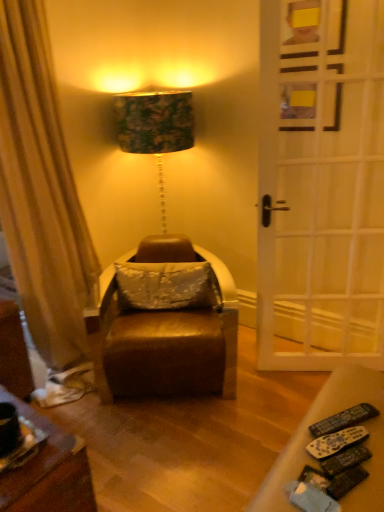
Describe the element at coordinates (321, 183) in the screenshot. The image size is (384, 512). I see `white wooden door at right` at that location.

Describe the element at coordinates (167, 286) in the screenshot. I see `satin white pillow at center` at that location.

Locate an element on the screen. leather swivel chair at center is located at coordinates point(168,335).

Considering their positions, is satin white pillow at center located in front of or behind black plastic remote control at lower right, arranged as the first remote control when viewed from the front?

Visually, satin white pillow at center is located behind black plastic remote control at lower right, arranged as the first remote control when viewed from the front.

What's the angular difference between satin white pillow at center and black plastic remote control at lower right, which is the 2th remote control from back to front,'s facing directions?

satin white pillow at center and black plastic remote control at lower right, which is the 2th remote control from back to front, are facing 70.6 degrees away from each other.

This screenshot has height=512, width=384. I want to click on pillow above the black plastic remote control at lower right, arranged as the first remote control when viewed from the front (from the image's perspective), so click(x=167, y=286).

Which is behind, point (156, 270) or point (314, 453)?

The point (156, 270) is behind.

Is leather swivel chair at center not near black plastic remote control at lower right, arranged as the first remote control when viewed from the front?

Absolutely, leather swivel chair at center is distant from black plastic remote control at lower right, arranged as the first remote control when viewed from the front.

Which of these two, leather swivel chair at center or black plastic remote control at lower right, which is the 2th remote control from back to front, stands taller?

leather swivel chair at center.

From a real-world perspective, count 2nd remote controls upward from the leather swivel chair at center and point to it. Please provide its 2D coordinates.

[(336, 442)]

Choose the correct answer: Is white wooden door at right inside leather swivel chair at center or outside it?

white wooden door at right is outside leather swivel chair at center.

At what (x,y) coordinates should I click in order to perform the action: click on swivel chair to the left of white wooden door at right. Please return your answer as a coordinate pair (x, y). Image resolution: width=384 pixels, height=512 pixels. Looking at the image, I should click on (168, 335).

Which is more to the left, white wooden door at right or leather swivel chair at center?

Positioned to the left is leather swivel chair at center.

From the image's perspective, is white wooden door at right over leather swivel chair at center?

Yes, from the image's perspective, white wooden door at right is above leather swivel chair at center.

Considering the points (189, 283) and (314, 178), which point is behind, point (189, 283) or point (314, 178)?

Positioned behind is point (314, 178).

From a real-world perspective, which object stands above the other?

white wooden door at right is physically above.

Locate an element on the screen. The width and height of the screenshot is (384, 512). pillow below the white wooden door at right (from the image's perspective) is located at coordinates (167, 286).

From the image's perspective, which object appears higher, satin white pillow at center or white wooden door at right?

white wooden door at right is shown above in the image.

From the picture: From a real-world perspective, who is located higher, black plastic remote control at lower right, the 1th remote control when ordered from back to front, or white wooden door at right?

white wooden door at right, from a real-world perspective.

Considering the relative sizes of black plastic remote control at lower right, the 1th remote control when ordered from back to front, and white wooden door at right in the image provided, is black plastic remote control at lower right, the 1th remote control when ordered from back to front, thinner than white wooden door at right?

In fact, black plastic remote control at lower right, the 1th remote control when ordered from back to front, might be wider than white wooden door at right.

You are a GUI agent. You are given a task and a screenshot of the screen. Output one action in this format:
    pyautogui.click(x=<x>, y=<y>)
    Task: Click on the remote control that is the 1st object located in front of the white wooden door at right
    The width and height of the screenshot is (384, 512).
    Given the screenshot: What is the action you would take?
    pyautogui.click(x=344, y=420)

Can you confirm if black plastic remote control at lower right, the 1th remote control when ordered from back to front, is positioned to the right of white wooden door at right?

No.

This screenshot has height=512, width=384. In order to click on remote control that is the 1st object directly below the white wooden door at right (from a real-world perspective) in this screenshot , I will do `click(336, 442)`.

In terms of height, does white wooden door at right look taller or shorter compared to black plastic remote control at lower right, which is the 2th remote control from back to front?

Considering their sizes, white wooden door at right has more height than black plastic remote control at lower right, which is the 2th remote control from back to front.

How many degrees apart are the facing directions of white wooden door at right and black plastic remote control at lower right, which is the 2th remote control from back to front?

67.4 degrees separate the facing orientations of white wooden door at right and black plastic remote control at lower right, which is the 2th remote control from back to front.

Which object is wider, white wooden door at right or black plastic remote control at lower right, arranged as the first remote control when viewed from the front?

black plastic remote control at lower right, arranged as the first remote control when viewed from the front, is wider.

Looking at this image, is the surface of black plastic remote control at lower right, arranged as the first remote control when viewed from the front, in direct contact with leather swivel chair at center?

No, black plastic remote control at lower right, arranged as the first remote control when viewed from the front, is not next to leather swivel chair at center.

Measure the distance between black plastic remote control at lower right, arranged as the first remote control when viewed from the front, and leather swivel chair at center.

black plastic remote control at lower right, arranged as the first remote control when viewed from the front, and leather swivel chair at center are 1.12 meters apart.

Does black plastic remote control at lower right, which is the 2th remote control from back to front, have a lesser width compared to leather swivel chair at center?

Indeed, black plastic remote control at lower right, which is the 2th remote control from back to front, has a lesser width compared to leather swivel chair at center.

Starting from the satin white pillow at center, which remote control is the 2nd one in front? Please provide its 2D coordinates.

[(336, 442)]

Identify the location of the 2nd remote control above the leather swivel chair at center (from a real-world perspective). This screenshot has height=512, width=384. (336, 442).

Looking at the image, which one is located further to leather swivel chair at center, satin white pillow at center or black plastic remote control at lower right, the 2th remote control when ordered from front to back?

Among the two, black plastic remote control at lower right, the 2th remote control when ordered from front to back, is located further to leather swivel chair at center.

Estimate the real-world distances between objects in this image. Which object is closer to satin white pillow at center, black plastic remote control at lower right, the 2th remote control when ordered from front to back, or black plastic remote control at lower right, which is the 2th remote control from back to front?

black plastic remote control at lower right, the 2th remote control when ordered from front to back, lies closer to satin white pillow at center than the other object.

Based on their spatial positions, is black plastic remote control at lower right, arranged as the first remote control when viewed from the front, or black plastic remote control at lower right, the 1th remote control when ordered from back to front, closer to satin white pillow at center?

black plastic remote control at lower right, the 1th remote control when ordered from back to front, is closer to satin white pillow at center.

Which object lies further to the anchor point black plastic remote control at lower right, which is the 2th remote control from back to front, satin white pillow at center or black plastic remote control at lower right, the 2th remote control when ordered from front to back?

Among the two, satin white pillow at center is located further to black plastic remote control at lower right, which is the 2th remote control from back to front.

Based on their spatial positions, is black plastic remote control at lower right, the 1th remote control when ordered from back to front, or black plastic remote control at lower right, which is the 2th remote control from back to front, closer to white wooden door at right?

black plastic remote control at lower right, the 1th remote control when ordered from back to front, is positioned closer to the anchor white wooden door at right.

Looking at the image, which one is located further to leather swivel chair at center, satin white pillow at center or white wooden door at right?

white wooden door at right lies further to leather swivel chair at center than the other object.

Estimate the real-world distances between objects in this image. Which object is further from leather swivel chair at center, white wooden door at right or satin white pillow at center?

Among the two, white wooden door at right is located further to leather swivel chair at center.

Which object lies further to the anchor point black plastic remote control at lower right, which is the 2th remote control from back to front, black plastic remote control at lower right, the 1th remote control when ordered from back to front, or satin white pillow at center?

satin white pillow at center lies further to black plastic remote control at lower right, which is the 2th remote control from back to front, than the other object.

Identify the location of swivel chair between black plastic remote control at lower right, the 2th remote control when ordered from front to back, and satin white pillow at center from front to back. pyautogui.click(x=168, y=335).

I want to click on remote control between black plastic remote control at lower right, arranged as the first remote control when viewed from the front, and leather swivel chair at center in the front-back direction, so click(344, 420).

Where is `door between black plastic remote control at lower right, the 2th remote control when ordered from front to back, and satin white pillow at center, along the z-axis`? Image resolution: width=384 pixels, height=512 pixels. door between black plastic remote control at lower right, the 2th remote control when ordered from front to back, and satin white pillow at center, along the z-axis is located at coordinates (321, 183).

Find the location of `door between black plastic remote control at lower right, which is the 2th remote control from back to front, and satin white pillow at center, along the z-axis`. door between black plastic remote control at lower right, which is the 2th remote control from back to front, and satin white pillow at center, along the z-axis is located at coordinates (321, 183).